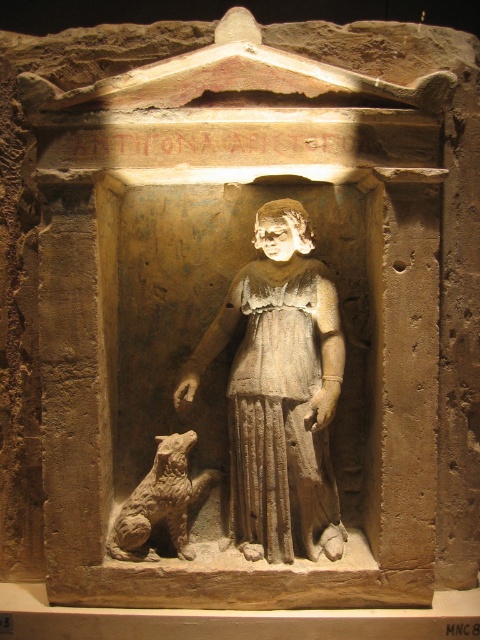
You are an archaeologist examining the ancient stone relief sculpture. You notice the gray stone statue at center and the brown textured dog at lower left. How far apart are these two objects in inches?

The gray stone statue at center is 13.75 inches from the brown textured dog at lower left.

You are an archaeologist examining the ancient stone relief sculpture. You need to determine if the gray stone statue at center can be moved through a doorway that is narrower than the width of the brown textured dog at lower left. Can it fit through?

The gray stone statue at center might be wider than the brown textured dog at lower left. Since the doorway is narrower than the dog, the statue likely cannot fit through the doorway.